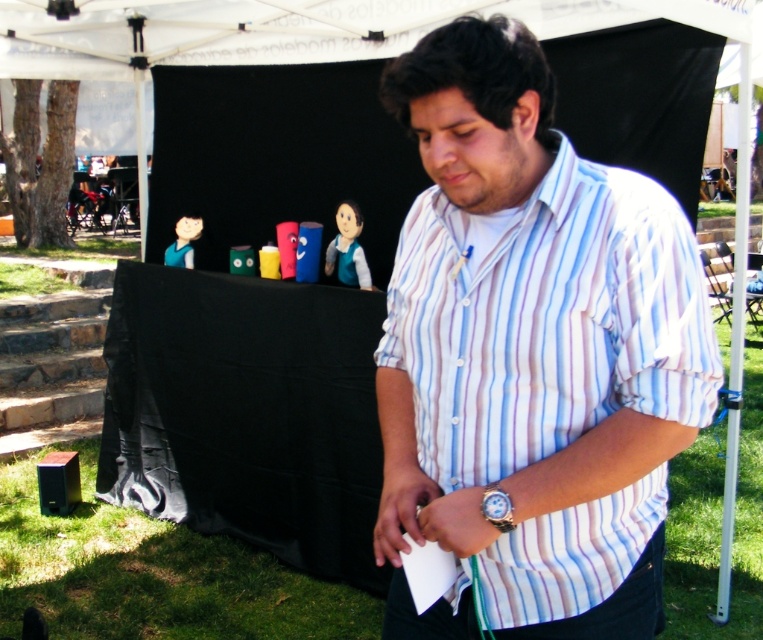
Question: Which is nearer to the white striped shirt at center?

Choices:
 (A) silver metallic watch at lower right
 (B) white fabric canopy at upper center

Answer: (A)

Question: Does white fabric canopy at upper center appear on the right side of silver metallic watch at lower right?

Choices:
 (A) yes
 (B) no

Answer: (B)

Question: Can you confirm if white striped shirt at center is positioned below silver metallic watch at lower right?

Choices:
 (A) no
 (B) yes

Answer: (A)

Question: Among these points, which one is farthest from the camera?

Choices:
 (A) (346, 35)
 (B) (528, 394)
 (C) (488, 484)

Answer: (A)

Question: Is white striped shirt at center in front of white fabric canopy at upper center?

Choices:
 (A) no
 (B) yes

Answer: (B)

Question: Which point is farther to the camera?

Choices:
 (A) (496, 528)
 (B) (464, 177)

Answer: (B)